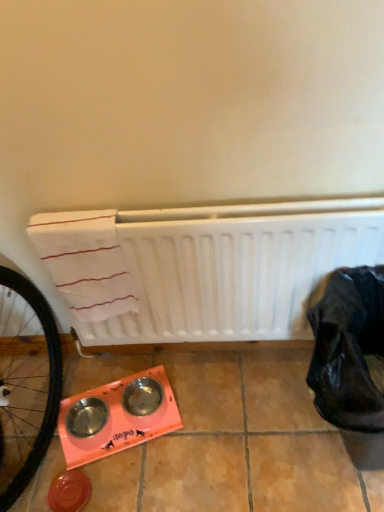
Find the location of a particular element. Image resolution: width=384 pixels, height=512 pixels. white matte radiator at center is located at coordinates (226, 266).

Describe the element at coordinates (226, 266) in the screenshot. The image size is (384, 512). I see `white matte radiator at center` at that location.

This screenshot has height=512, width=384. I want to click on black fabric bag at lower right, so click(x=350, y=361).

This screenshot has height=512, width=384. What do you see at coordinates (350, 361) in the screenshot?
I see `black fabric bag at lower right` at bounding box center [350, 361].

This screenshot has width=384, height=512. What are the coordinates of `white matte radiator at center` in the screenshot? It's located at (226, 266).

Is white matte radiator at center to the left or to the right of black fabric bag at lower right in the image?

Based on their positions, white matte radiator at center is located to the left of black fabric bag at lower right.

From the picture: Relative to black fabric bag at lower right, is white matte radiator at center in front or behind?

In the image, white matte radiator at center appears behind black fabric bag at lower right.

Which is farther, (150, 215) or (356, 452)?

The point (356, 452) is farther.

From the image's perspective, is white matte radiator at center positioned above or below black fabric bag at lower right?

Clearly, from the image's perspective, white matte radiator at center is above black fabric bag at lower right.

From a real-world perspective, is white matte radiator at center located beneath black fabric bag at lower right?

No, from a real-world perspective, white matte radiator at center is not under black fabric bag at lower right.

In terms of width, does white matte radiator at center look wider or thinner when compared to black fabric bag at lower right?

In the image, white matte radiator at center appears to be more narrow than black fabric bag at lower right.

Does white matte radiator at center have a lesser height compared to black fabric bag at lower right?

No.

Considering the sizes of objects white matte radiator at center and black fabric bag at lower right in the image provided, who is bigger, white matte radiator at center or black fabric bag at lower right?

black fabric bag at lower right is bigger.

Would you say white matte radiator at center contains black fabric bag at lower right?

No, black fabric bag at lower right is not inside white matte radiator at center.

Is white matte radiator at center next to black fabric bag at lower right and touching it?

No, white matte radiator at center is not beside black fabric bag at lower right.

From the picture: Is white matte radiator at center positioned with its back to black fabric bag at lower right?

No, white matte radiator at center is not facing the opposite direction of black fabric bag at lower right.

Can you tell me how much white matte radiator at center and black fabric bag at lower right differ in facing direction?

There is a 1.22-degree angle between the facing directions of white matte radiator at center and black fabric bag at lower right.

The width and height of the screenshot is (384, 512). What are the coordinates of `waste located below the white matte radiator at center (from the image's perspective)` in the screenshot? It's located at (350, 361).

Which is more to the left, black fabric bag at lower right or white matte radiator at center?

Positioned to the left is white matte radiator at center.

Is the depth of black fabric bag at lower right less than that of white matte radiator at center?

Yes, the depth of black fabric bag at lower right is less than that of white matte radiator at center.

Which is nearer, (328, 319) or (305, 323)?

Positioned in front is point (328, 319).

From the image's perspective, which is above, black fabric bag at lower right or white matte radiator at center?

white matte radiator at center is shown above in the image.

From a real-world perspective, is black fabric bag at lower right positioned over white matte radiator at center based on gravity?

No, from a real-world perspective, black fabric bag at lower right is not above white matte radiator at center.

Which object is thinner, black fabric bag at lower right or white matte radiator at center?

With smaller width is white matte radiator at center.

From the picture: Considering the relative sizes of black fabric bag at lower right and white matte radiator at center in the image provided, is black fabric bag at lower right taller than white matte radiator at center?

Incorrect, the height of black fabric bag at lower right is not larger of that of white matte radiator at center.

Can you confirm if black fabric bag at lower right is smaller than white matte radiator at center?

No.

Is black fabric bag at lower right inside the boundaries of white matte radiator at center, or outside?

black fabric bag at lower right cannot be found inside white matte radiator at center.

Are black fabric bag at lower right and white matte radiator at center located far from each other?

No, black fabric bag at lower right is not far from white matte radiator at center.

Is black fabric bag at lower right facing away from white matte radiator at center?

Yes.

How many degrees apart are the facing directions of black fabric bag at lower right and white matte radiator at center?

The facing directions of black fabric bag at lower right and white matte radiator at center are 1.22 degrees apart.

Locate an element on the screen. waste that is in front of the white matte radiator at center is located at coordinates (350, 361).

Identify the location of water heater above the black fabric bag at lower right (from the image's perspective). (226, 266).

Where is `waste below the white matte radiator at center (from the image's perspective)`? This screenshot has height=512, width=384. waste below the white matte radiator at center (from the image's perspective) is located at coordinates (350, 361).